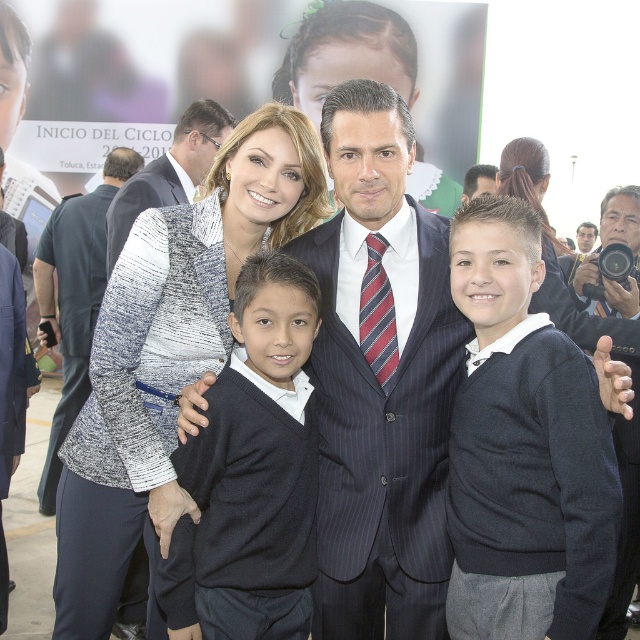
Which of these two, white textured sweater at center or dark blue suit at center, stands taller?

Standing taller between the two is white textured sweater at center.

Who is more forward, (176,132) or (611,221)?

Point (611,221) is in front.

Where is `white textured sweater at center`? The image size is (640, 640). white textured sweater at center is located at coordinates (168, 172).

How distant is dark gray sweater at center from dark gray suit at center?

They are 5.57 feet apart.

Is dark gray sweater at center wider than dark gray suit at center?

Incorrect, dark gray sweater at center's width does not surpass dark gray suit at center's.

Who is more distant from viewer, (492, 384) or (611, 282)?

Positioned behind is point (611, 282).

Identify the location of dark gray sweater at center. (524, 448).

In the scene shown: Does dark gray sweater at center have a smaller size compared to pinstriped wool suit at center?

No.

Which is behind, point (520, 589) or point (326, 456)?

The point (326, 456) is behind.

Identify the location of dark gray sweater at center. (524, 448).